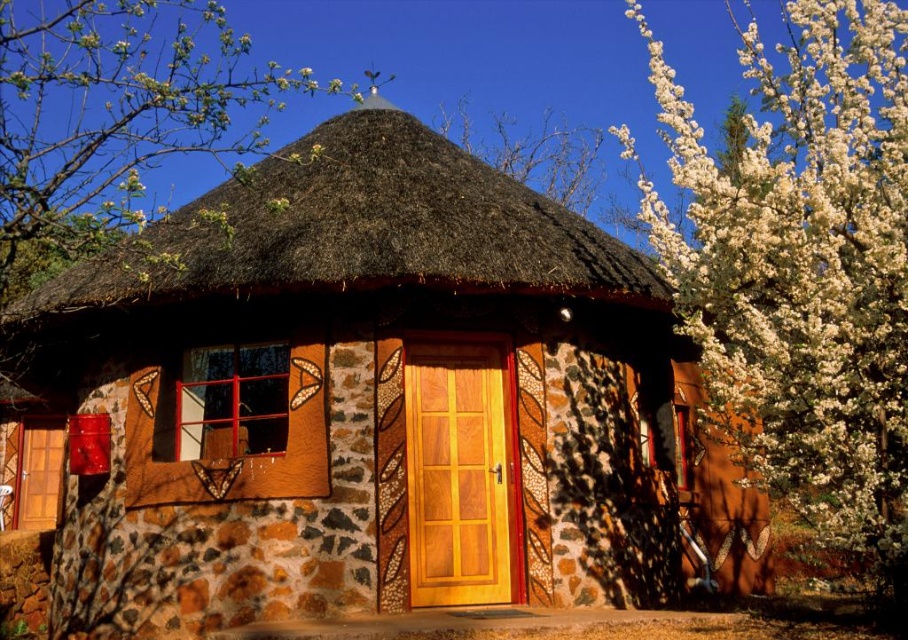
You are standing in front of the rustic stone cottage at center and want to place a decorative wreath above its entrance. Since the brown thatch at center is above the cottage, where should you position the wreath to ensure it is above the entrance but below the thatch?

The wreath should be placed above the entrance of the rustic stone cottage at center but below the brown thatch at center, as the cottage is located below the thatch.

You are standing in front of the round house and notice two elements in the background. Which one is taller, the white fluffy petals at upper right or the green leafy tree at upper left?

The white fluffy petals at upper right is much taller than the green leafy tree at upper left.